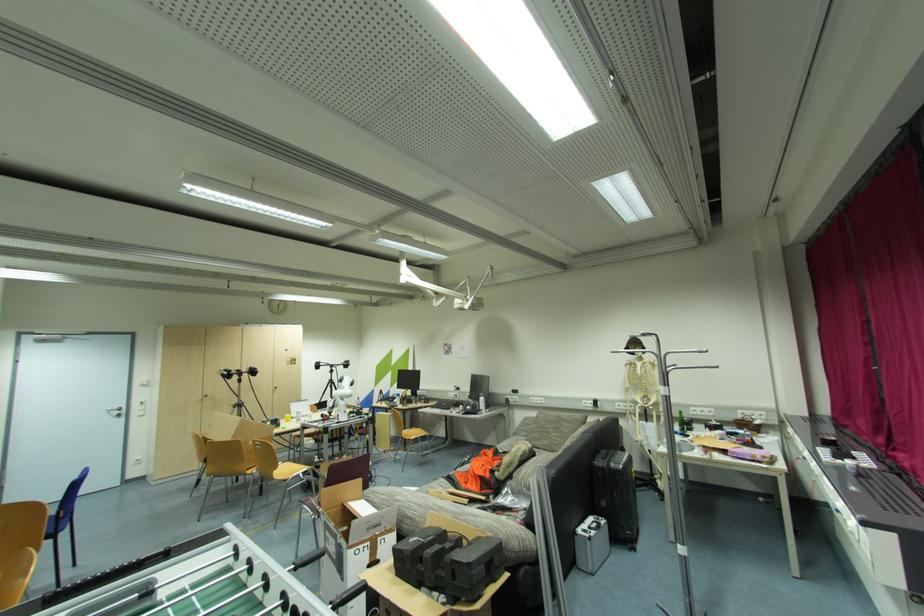
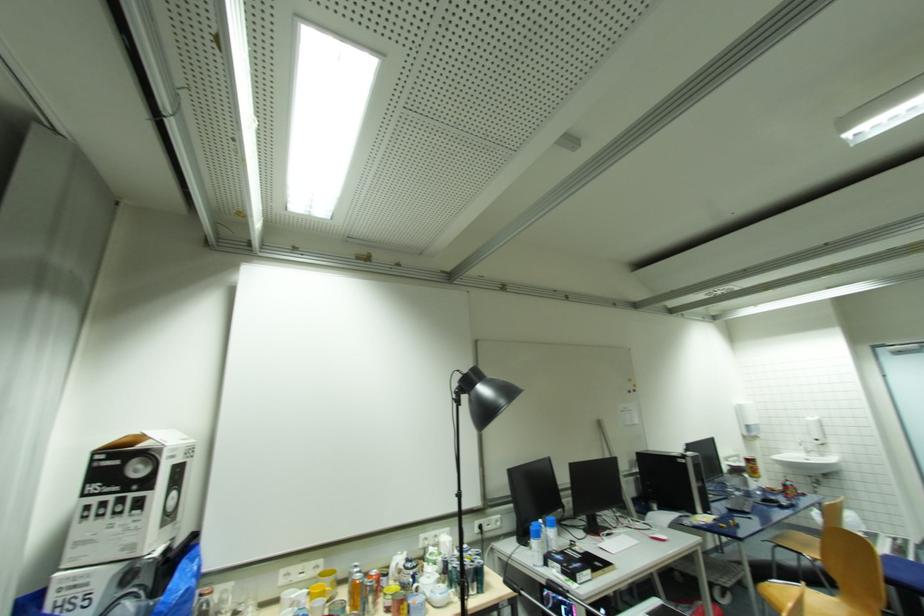
The images are taken continuously from a first-person perspective. In which direction is your viewpoint rotating?

The camera's rotation is toward left-up.